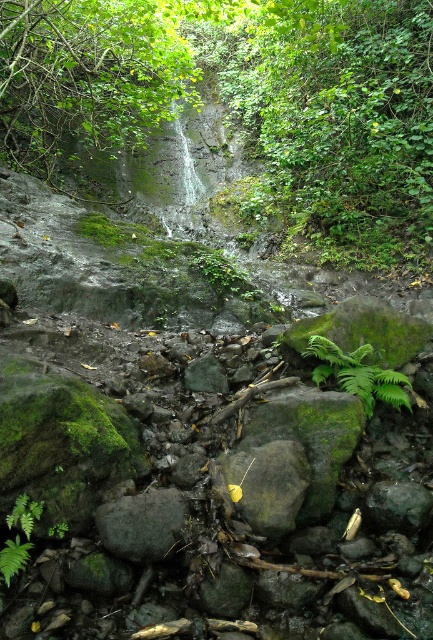
Question: Among these points, which one is farthest from the camera?

Choices:
 (A) (19, 19)
 (B) (394, 401)

Answer: (A)

Question: Is green leafy tree at upper center positioned in front of green mossy rock at center?

Choices:
 (A) yes
 (B) no

Answer: (B)

Question: Which object is positioned closest to the green leafy fern at center?

Choices:
 (A) green mossy rock at center
 (B) green leafy tree at upper center

Answer: (A)

Question: Does green mossy rock at center appear over green leafy fern at center?

Choices:
 (A) yes
 (B) no

Answer: (B)

Question: Which object is positioned closest to the green mossy rock at center?

Choices:
 (A) green leafy fern at center
 (B) green leafy tree at upper center

Answer: (A)

Question: Observing the image, what is the correct spatial positioning of green leafy tree at upper center in reference to green leafy fern at center?

Choices:
 (A) below
 (B) above

Answer: (B)